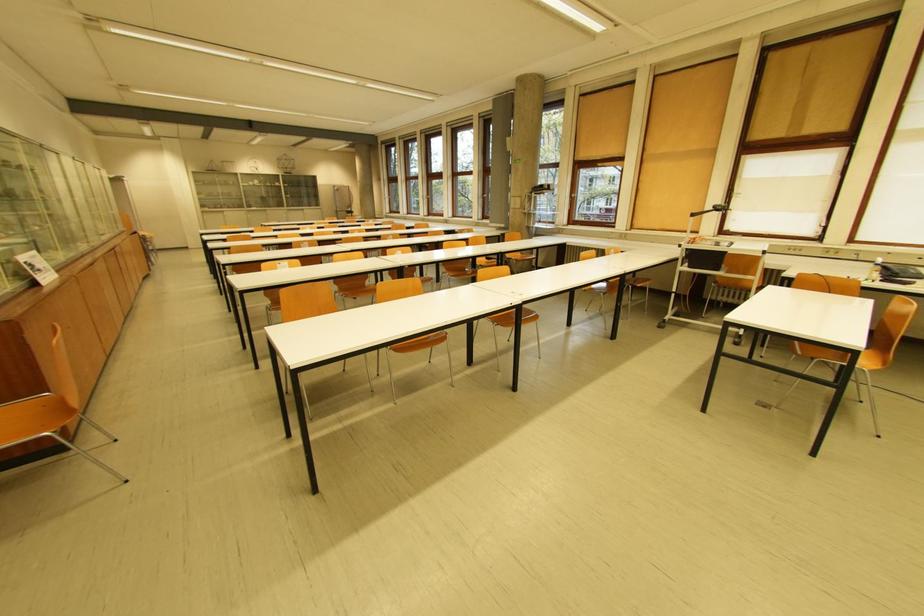
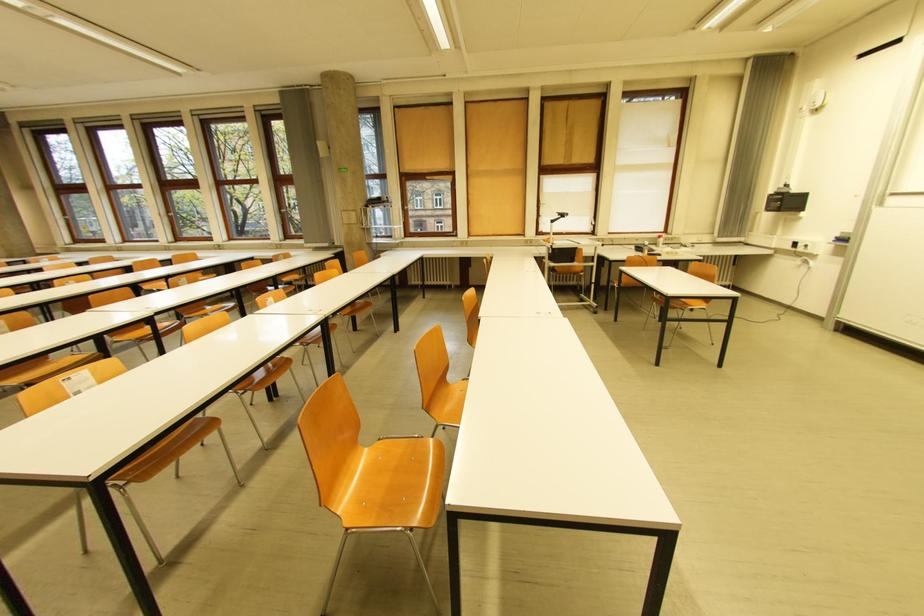
In the second image, find the point that corresponds to point (642, 228) in the first image.

(479, 235)